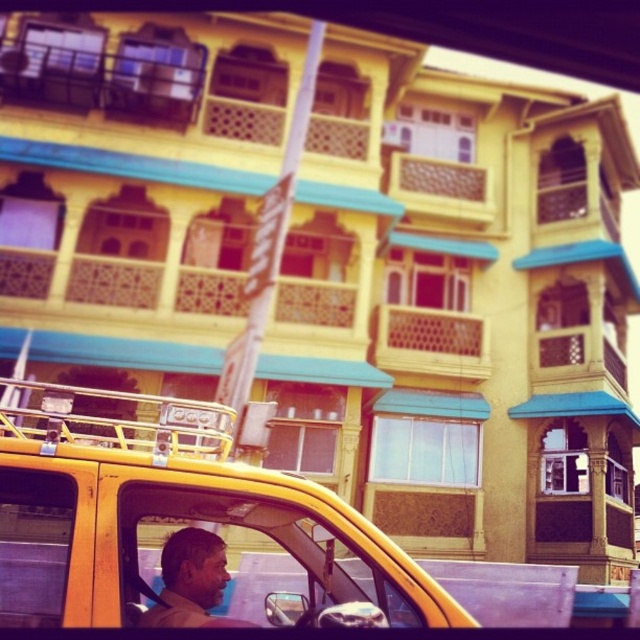
Is transparent glass window at lower left below matte brown skin at center?

Yes, transparent glass window at lower left is below matte brown skin at center.

Who is more distant from viewer, (29, 589) or (202, 552)?

The point (29, 589) is behind.

Does point (40, 625) come behind point (221, 566)?

No, (40, 625) is closer to viewer.

At what (x,y) coordinates should I click in order to perform the action: click on transparent glass window at lower left. Please return your answer as a coordinate pair (x, y). The height and width of the screenshot is (640, 640). Looking at the image, I should click on (35, 545).

Measure the distance between point (112,528) and camera.

Point (112,528) is 1.92 meters from camera.

Does yellow matte taxi at center have a greater height compared to matte brown skin at center?

Yes, yellow matte taxi at center is taller than matte brown skin at center.

Between point (122, 456) and point (220, 556), which one is positioned in front?

Point (122, 456)

Locate an element on the screen. The height and width of the screenshot is (640, 640). yellow matte taxi at center is located at coordinates (180, 525).

Is point (241, 508) farther from camera compared to point (193, 538)?

Yes.

Who is positioned more to the right, yellow matte taxi at center or transparent plastic window at center?

transparent plastic window at center is more to the right.

The height and width of the screenshot is (640, 640). What do you see at coordinates (180, 525) in the screenshot? I see `yellow matte taxi at center` at bounding box center [180, 525].

Locate an element on the screen. yellow matte taxi at center is located at coordinates (180, 525).